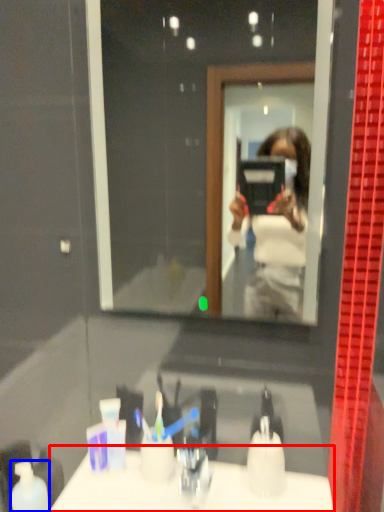
Question: Which object appears farthest to the camera in this image, counter top (highlighted by a red box) or mouthwash (highlighted by a blue box)?

Choices:
 (A) counter top
 (B) mouthwash

Answer: (B)